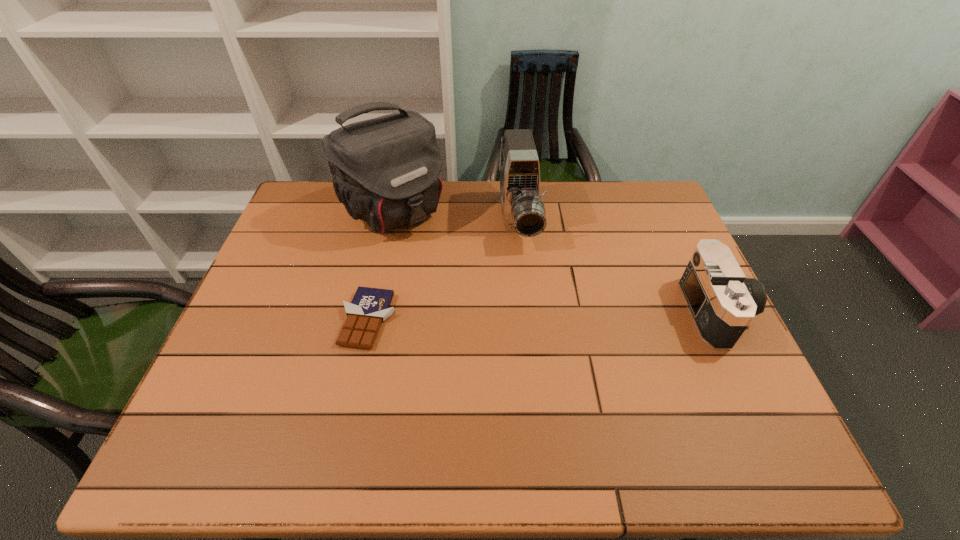
Find the location of a particular element. vacant space on the desktop that is between the chocolate bar and the camera and is positioned at the front of the third object from left to right, highlighting the lens is located at coordinates (534, 316).

Find the location of `vacant spot on the desktop that is between the chocolate bar and the camera and is positioned on the open flap of the shoulder bag`. vacant spot on the desktop that is between the chocolate bar and the camera and is positioned on the open flap of the shoulder bag is located at coordinates (494, 317).